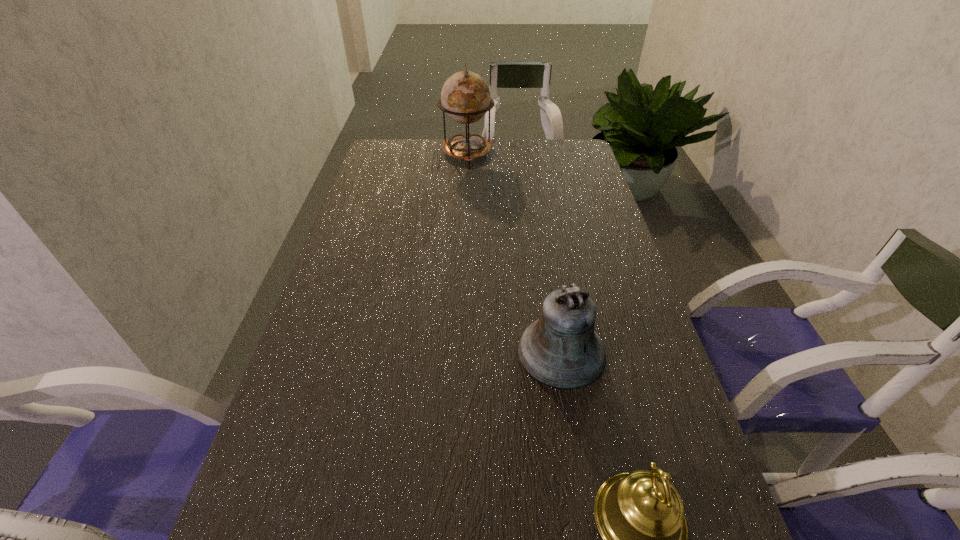
Identify the location of vacant space at the far right corner. This screenshot has height=540, width=960. (566, 148).

Where is `free space between the second farthest object and the tallest object`? The image size is (960, 540). free space between the second farthest object and the tallest object is located at coordinates (515, 252).

Find the location of `vacant space that's between the farthest object and the farther bell`. vacant space that's between the farthest object and the farther bell is located at coordinates (515, 252).

Image resolution: width=960 pixels, height=540 pixels. Find the location of `vacant area that lies between the farthest object and the farther bell`. vacant area that lies between the farthest object and the farther bell is located at coordinates (515, 252).

This screenshot has width=960, height=540. I want to click on the second closest object to the farther bell, so click(x=465, y=97).

Identify which object is the second nearest to the farther bell. Please provide its 2D coordinates. Your answer should be formatted as a tuple, i.e. [(x, y)], where the tuple contains the x and y coordinates of a point satisfying the conditions above.

[(465, 97)]

Image resolution: width=960 pixels, height=540 pixels. In order to click on vacant area that satisfies the following two spatial constraints: 1. at the center of the farthest object; 2. on the right side of the second nearest object in this screenshot , I will do `click(458, 352)`.

Identify the location of vacant space that satisfies the following two spatial constraints: 1. at the center of the farthest object; 2. on the left side of the farther bell. (458, 352).